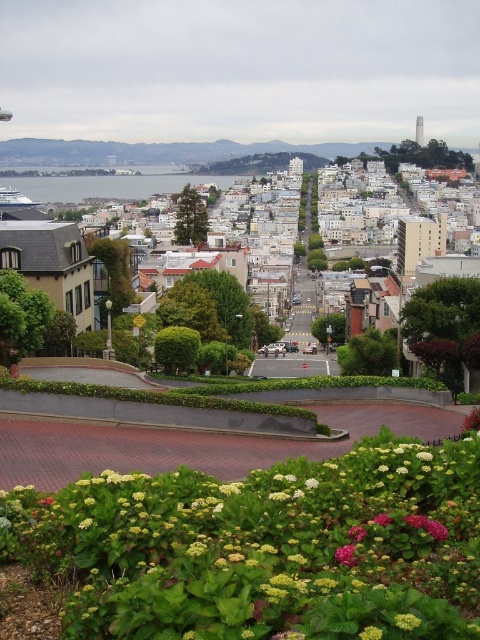
Between point (176, 177) and point (404, 630), which one is positioned in front?

Point (404, 630)

Is blue water at center bigger than green leafy plant at lower right?

Indeed, blue water at center has a larger size compared to green leafy plant at lower right.

Which is in front, point (112, 182) or point (410, 618)?

Point (410, 618) is more forward.

You are a GUI agent. You are given a task and a screenshot of the screen. Output one action in this format:
    pyautogui.click(x=<x>, y=<y>)
    Task: Click on the blue water at center
    
    Given the screenshot: What is the action you would take?
    pyautogui.click(x=107, y=186)

Describe the element at coordinates (346, 556) in the screenshot. I see `purple matte flower at center` at that location.

Between purple matte flower at center and green leafy plant at lower right, which one is positioned higher?

purple matte flower at center is higher up.

Consider the image. Who is more distant from viewer, [337,550] or [395,621]?

Point [337,550]

Where is `purple matte flower at center`? Image resolution: width=480 pixels, height=640 pixels. purple matte flower at center is located at coordinates (346, 556).

Can you confirm if green leafy bush at lower center is positioned to the right of purple matte flower at center?

No, green leafy bush at lower center is not to the right of purple matte flower at center.

Which is below, green leafy bush at lower center or purple matte flower at center?

purple matte flower at center

Describe the element at coordinates (263, 547) in the screenshot. I see `green leafy bush at lower center` at that location.

You are a GUI agent. You are given a task and a screenshot of the screen. Output one action in this format:
    pyautogui.click(x=<x>, y=<y>)
    Task: Click on the green leafy bush at lower center
    
    Given the screenshot: What is the action you would take?
    pyautogui.click(x=263, y=547)